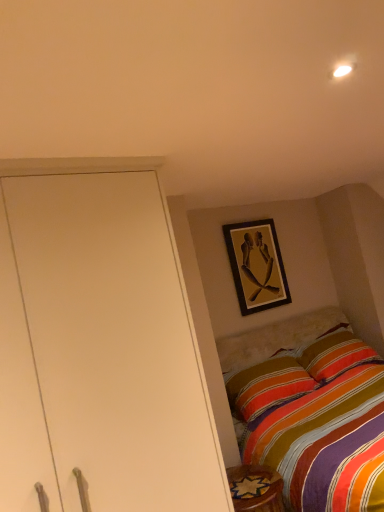
Question: Is carpeted rug at lower right wider or thinner than wooden framed artwork at upper center?

Choices:
 (A) thin
 (B) wide

Answer: (B)

Question: Based on their positions, is carpeted rug at lower right located to the left or right of wooden framed artwork at upper center?

Choices:
 (A) right
 (B) left

Answer: (B)

Question: In terms of size, does carpeted rug at lower right appear bigger or smaller than wooden framed artwork at upper center?

Choices:
 (A) small
 (B) big

Answer: (A)

Question: Is wooden framed artwork at upper center inside or outside of carpeted rug at lower right?

Choices:
 (A) inside
 (B) outside

Answer: (B)

Question: Is wooden framed artwork at upper center bigger or smaller than carpeted rug at lower right?

Choices:
 (A) small
 (B) big

Answer: (B)

Question: Considering their positions, is wooden framed artwork at upper center located in front of or behind carpeted rug at lower right?

Choices:
 (A) front
 (B) behind

Answer: (B)

Question: From the image's perspective, relative to carpeted rug at lower right, is wooden framed artwork at upper center above or below?

Choices:
 (A) below
 (B) above

Answer: (B)